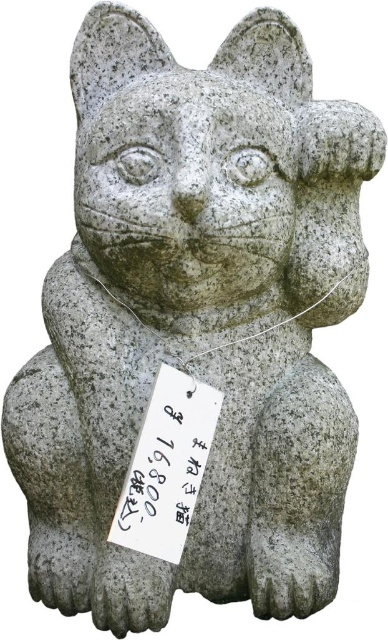
Does black paper at center appear over gray stone cat at center?

Incorrect, black paper at center is not positioned above gray stone cat at center.

Who is positioned more to the left, black paper at center or gray stone cat at center?

black paper at center is more to the left.

Locate an element on the screen. black paper at center is located at coordinates (166, 470).